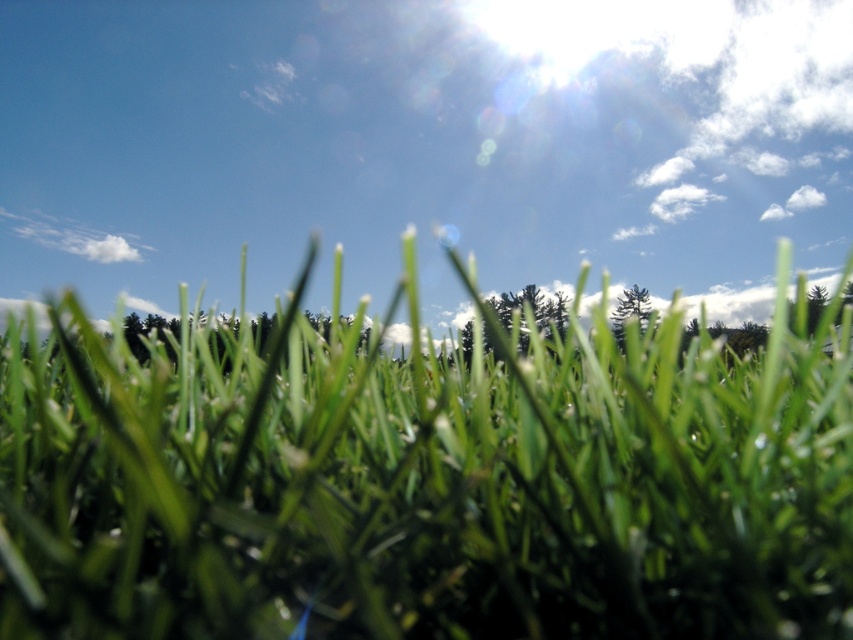
Question: Does bright blue sky at upper center have a lesser width compared to green matte tree at upper center?

Choices:
 (A) yes
 (B) no

Answer: (B)

Question: Estimate the real-world distances between objects in this image. Which object is closer to the bright blue sky at upper center?

Choices:
 (A) green grass at center
 (B) green matte tree at center

Answer: (B)

Question: Among these points, which one is farthest from the camera?

Choices:
 (A) (526, 298)
 (B) (585, 394)
 (C) (729, 243)

Answer: (C)

Question: Does green matte tree at center appear over green matte tree at upper center?

Choices:
 (A) yes
 (B) no

Answer: (A)

Question: Estimate the real-world distances between objects in this image. Which object is farther from the green matte tree at upper center?

Choices:
 (A) green grass at center
 (B) green matte tree at center
 (C) bright blue sky at upper center

Answer: (A)

Question: Observing the image, what is the correct spatial positioning of green matte tree at center in reference to green matte tree at upper center?

Choices:
 (A) below
 (B) above

Answer: (B)